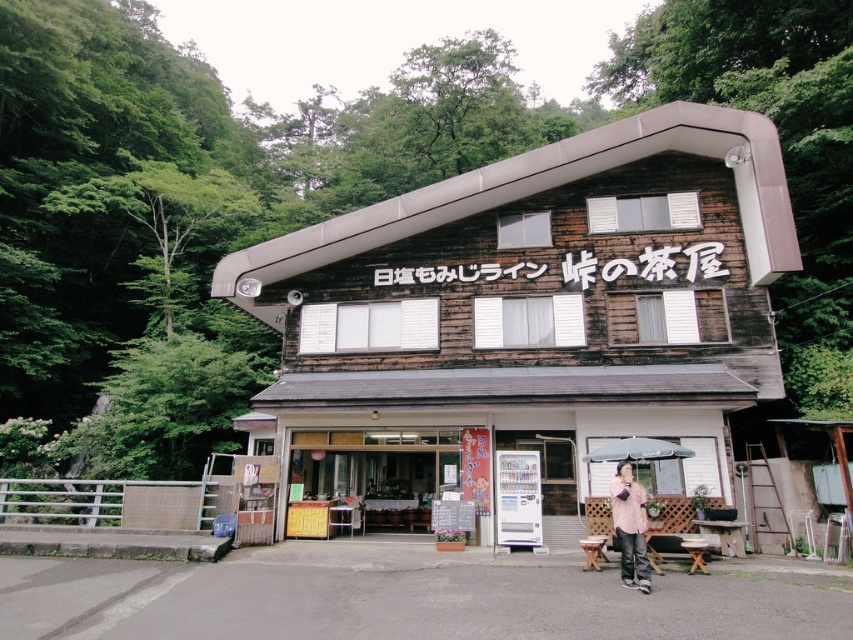
You are a visitor standing at the entrance of the weathered wood store at center and want to find the pink fabric jacket at lower right. Which direction should you move to locate it?

The pink fabric jacket at lower right is positioned on the right side of the weathered wood store at center, so you should move to your right to locate it.

You are standing at the entrance of the tea house and want to find the weathered wood store at center. What are the coordinates where you should look?

The weathered wood store at center is located at coordinates point (529, 312).